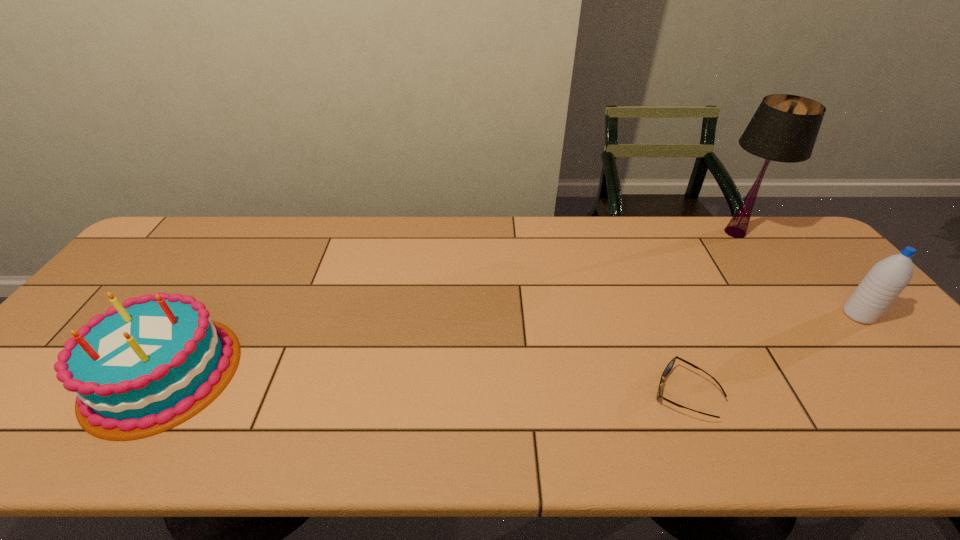
This screenshot has height=540, width=960. What are the coordinates of `vacant position in the image that satisfies the following two spatial constraints: 1. on the front-facing side of the water bottle; 2. on the left side of the tallest object` in the screenshot? It's located at (795, 315).

Identify the location of vacant space that satisfies the following two spatial constraints: 1. on the front-facing side of the third object from left to right; 2. at the front of the second object from left to right showing the lenses. The width and height of the screenshot is (960, 540). (851, 393).

Find the location of `vacant point that satisfies the following two spatial constraints: 1. on the front-facing side of the second object from right to left; 2. at the front of the sunglasses showing the lenses`. vacant point that satisfies the following two spatial constraints: 1. on the front-facing side of the second object from right to left; 2. at the front of the sunglasses showing the lenses is located at coordinates (851, 393).

The height and width of the screenshot is (540, 960). Identify the location of free spot that satisfies the following two spatial constraints: 1. on the front-facing side of the third object from left to right; 2. at the front of the sunglasses showing the lenses. click(x=851, y=393).

The image size is (960, 540). What are the coordinates of `free location that satisfies the following two spatial constraints: 1. on the front-facing side of the third object from left to right; 2. on the right side of the rightmost object` in the screenshot? It's located at click(795, 315).